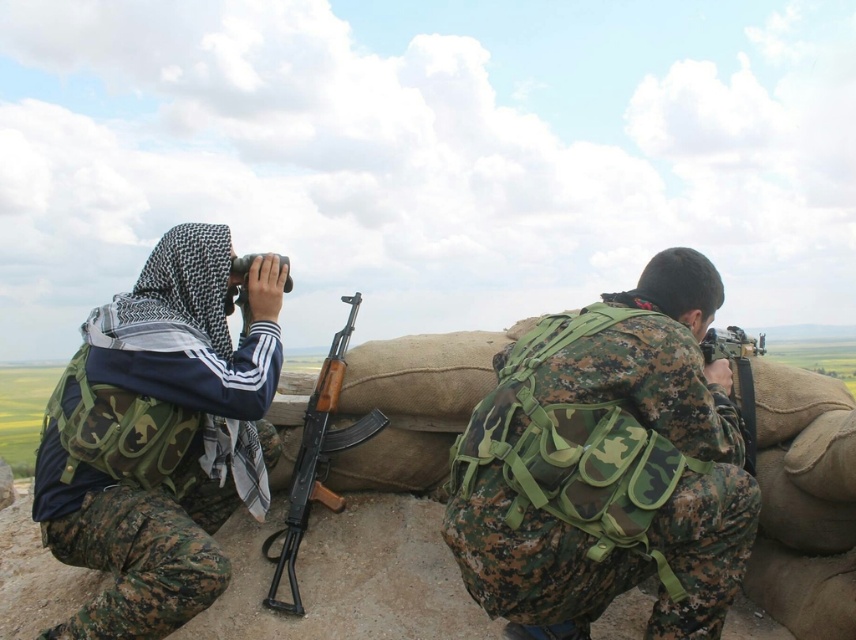
Question: Among these objects, which one is farthest from the camera?

Choices:
 (A) wooden stock rifle at center
 (B) matte black binoculars at upper center

Answer: (A)

Question: Which point is farther to the camera?

Choices:
 (A) (242, 300)
 (B) (135, 557)

Answer: (A)

Question: Observing the image, what is the correct spatial positioning of wooden stock rifle at center in reference to matte black rifle at center?

Choices:
 (A) right
 (B) left

Answer: (B)

Question: Considering the real-world distances, which object is farthest from the wooden stock rifle at center?

Choices:
 (A) matte black rifle at center
 (B) camo fabric backpack at left

Answer: (A)

Question: Is camo fabric backpack at center further to the viewer compared to matte black rifle at center?

Choices:
 (A) yes
 (B) no

Answer: (B)

Question: Does camo fabric backpack at left have a smaller size compared to matte black rifle at center?

Choices:
 (A) yes
 (B) no

Answer: (B)